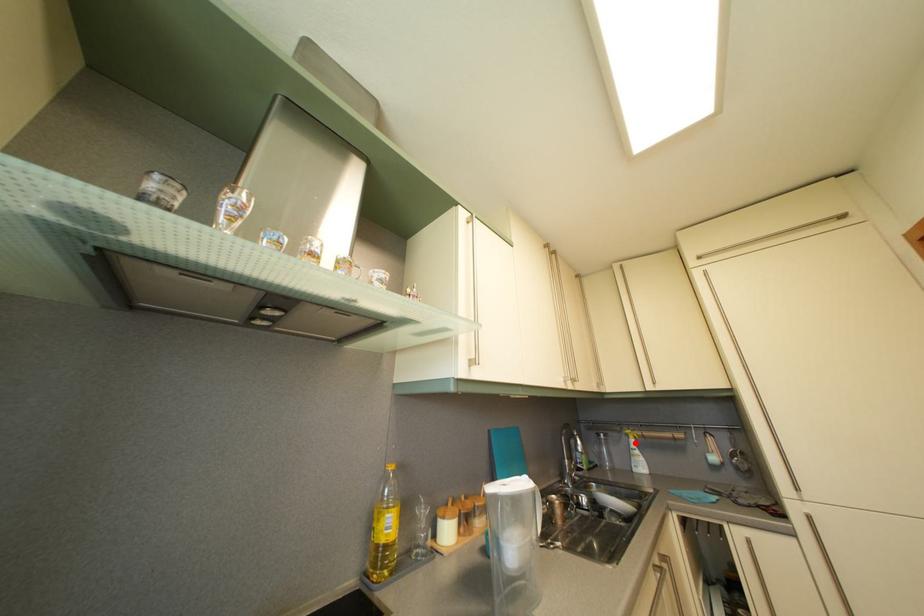
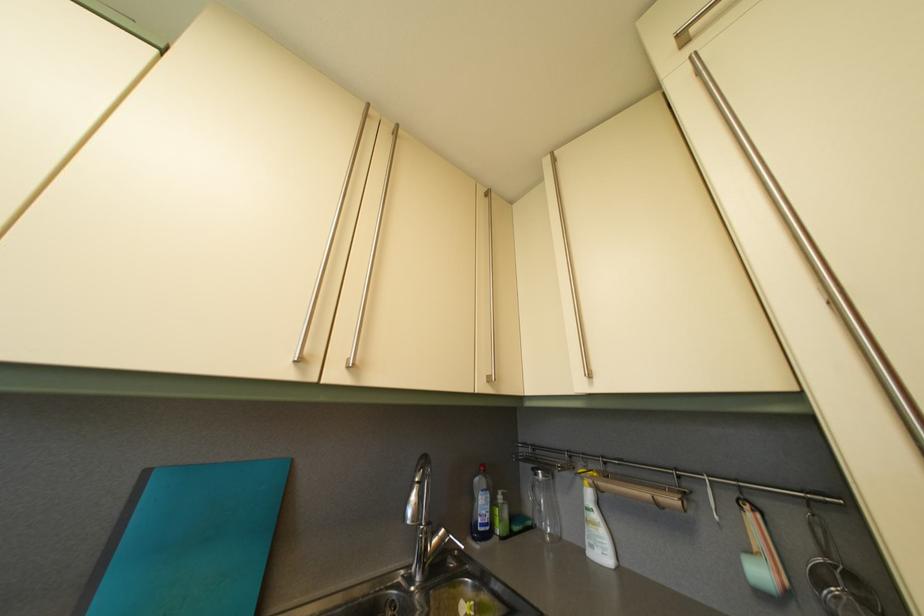
Find the pixel in the second image that matches the highlighted location in the first image.

(590, 485)